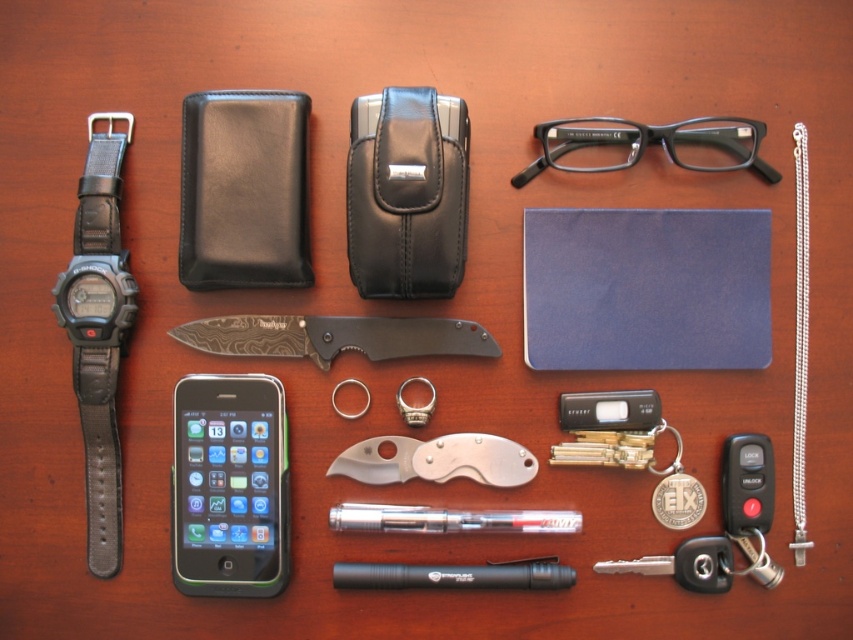
Is silver metallic pocket knife at center shorter than silver chain necklace at right?

Yes, silver metallic pocket knife at center is shorter than silver chain necklace at right.

Is silver metallic pocket knife at center to the left of silver chain necklace at right from the viewer's perspective?

Correct, you'll find silver metallic pocket knife at center to the left of silver chain necklace at right.

This screenshot has height=640, width=853. I want to click on silver metallic pocket knife at center, so click(x=437, y=460).

Does black plastic glasses at upper center appear over silver metallic pocket knife at center?

Correct, black plastic glasses at upper center is located above silver metallic pocket knife at center.

In the scene shown: Which is below, black plastic glasses at upper center or silver metallic pocket knife at center?

silver metallic pocket knife at center is lower down.

Describe the element at coordinates (646, 145) in the screenshot. I see `black plastic glasses at upper center` at that location.

Locate an element on the screen. The image size is (853, 640). black plastic glasses at upper center is located at coordinates (646, 145).

Can you confirm if green glossy smartphone at lower left is positioned below black plastic glasses at upper center?

Correct, green glossy smartphone at lower left is located below black plastic glasses at upper center.

What do you see at coordinates (229, 486) in the screenshot? I see `green glossy smartphone at lower left` at bounding box center [229, 486].

This screenshot has width=853, height=640. Find the location of `green glossy smartphone at lower left`. green glossy smartphone at lower left is located at coordinates (229, 486).